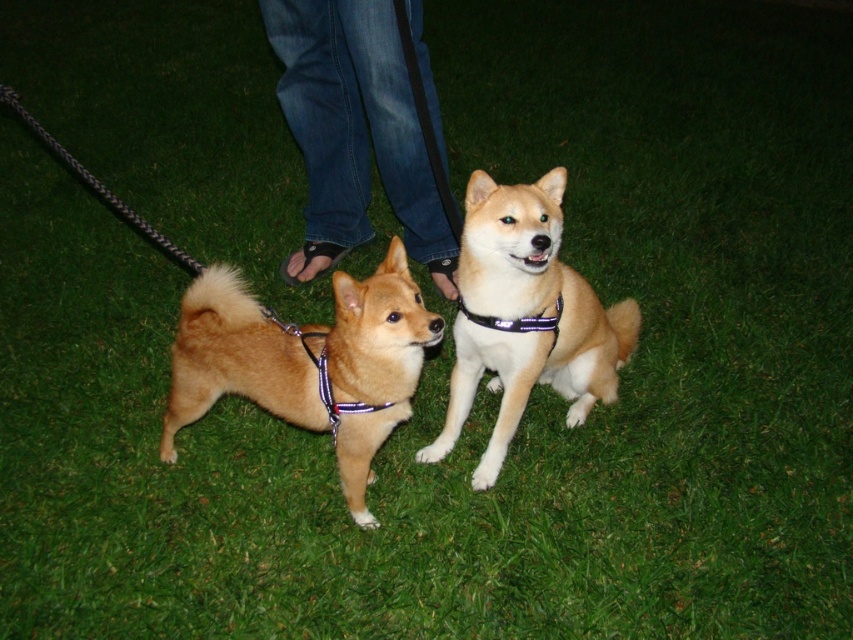
Question: Can you confirm if shiny brown dog at center is wider than black fabric neckband at center?

Choices:
 (A) yes
 (B) no

Answer: (A)

Question: Which object appears closest to the camera in this image?

Choices:
 (A) black fabric neckband at center
 (B) shiny brown dog at center

Answer: (B)

Question: Is shiny brown dog at center further to the viewer compared to black fabric neckband at center?

Choices:
 (A) yes
 (B) no

Answer: (B)

Question: Estimate the real-world distances between objects in this image. Which object is farther from the shiny brown dog at center?

Choices:
 (A) light brown fur at center
 (B) black fabric neckband at center
 (C) jeans at center

Answer: (C)

Question: Is shiny brown dog at center in front of light brown fur at center?

Choices:
 (A) no
 (B) yes

Answer: (B)

Question: Estimate the real-world distances between objects in this image. Which object is closer to the black fabric neckband at center?

Choices:
 (A) light brown fur at center
 (B) shiny brown dog at center
 (C) jeans at center

Answer: (A)